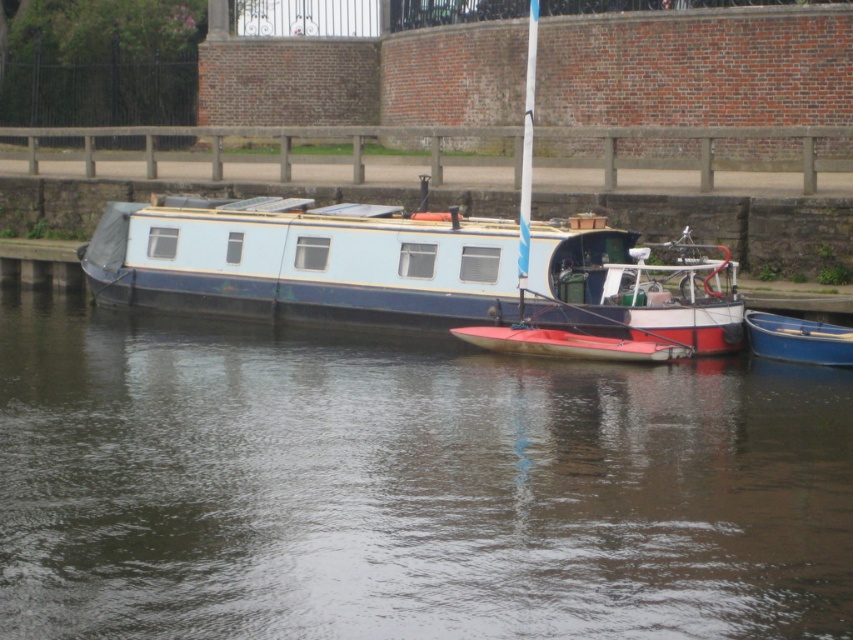
Question: From the image, what is the correct spatial relationship of smooth water at center in relation to blue plastic boat at lower right?

Choices:
 (A) right
 (B) left

Answer: (B)

Question: Can you confirm if smooth water at center is positioned below red matte dinghy at center?

Choices:
 (A) no
 (B) yes

Answer: (B)

Question: Which object appears closest to the camera in this image?

Choices:
 (A) red matte dinghy at center
 (B) blue painted wood houseboat at center
 (C) blue plastic boat at lower right
 (D) smooth water at center

Answer: (D)

Question: In this image, where is red matte dinghy at center located relative to blue plastic boat at lower right?

Choices:
 (A) left
 (B) right

Answer: (A)

Question: Among these points, which one is farthest from the camera?

Choices:
 (A) (593, 337)
 (B) (816, 346)

Answer: (A)

Question: Which of the following is the farthest from the observer?

Choices:
 (A) blue painted wood houseboat at center
 (B) red matte dinghy at center
 (C) blue plastic boat at lower right

Answer: (A)